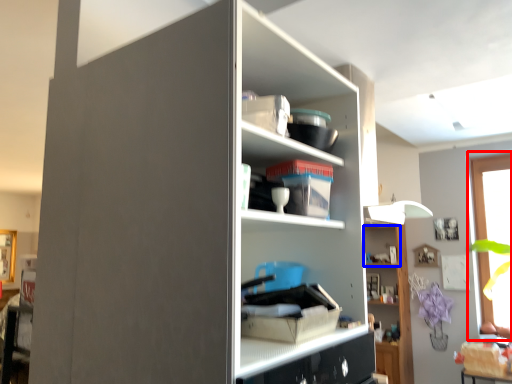
Question: Which object appears farthest to the camera in this image, window (highlighted by a red box) or cabinet (highlighted by a blue box)?

Choices:
 (A) window
 (B) cabinet

Answer: (B)